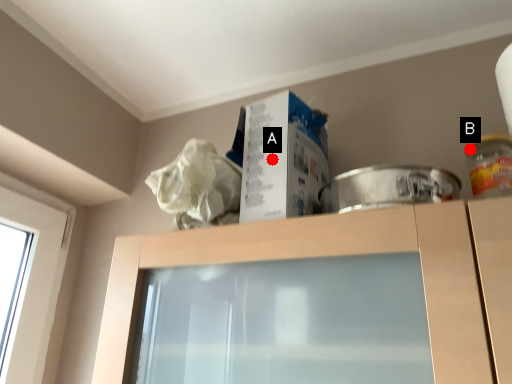
Question: Two points are circled on the image, labeled by A and B beside each circle. Among these points, which one is farthest from the camera?

Choices:
 (A) A is further
 (B) B is further

Answer: (B)